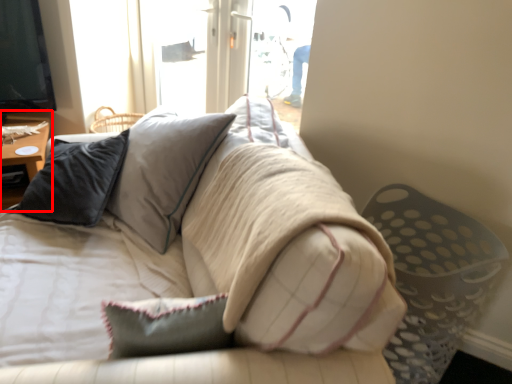
Question: From the image's perspective, considering the relative positions of table (annotated by the red box) and studio couch in the image provided, where is table (annotated by the red box) located with respect to the staircase?

Choices:
 (A) above
 (B) below

Answer: (A)